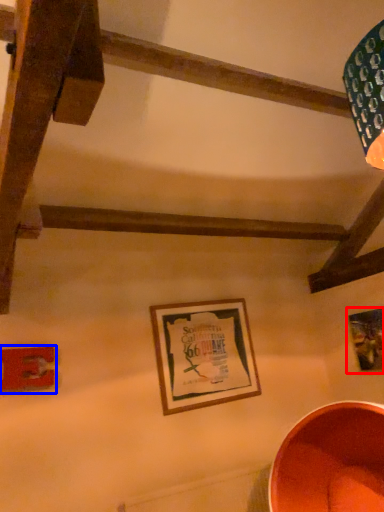
Question: Which object is further to the camera taking this photo, picture frame (highlighted by a red box) or picture frame (highlighted by a blue box)?

Choices:
 (A) picture frame
 (B) picture frame

Answer: (A)